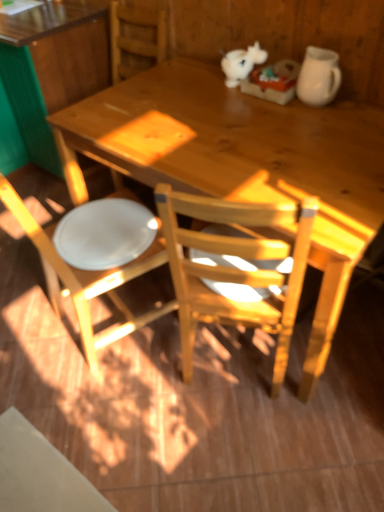
Question: Would you say white matte chair at left is to the left or to the right of wooden desk at upper left, which is the second desk in right-to-left order, in the picture?

Choices:
 (A) right
 (B) left

Answer: (A)

Question: From the image's perspective, relative to wooden desk at upper left, placed as the 1th desk when sorted from left to right, is white matte chair at left above or below?

Choices:
 (A) above
 (B) below

Answer: (B)

Question: Which of these objects is positioned farthest from the white matte unicorn at upper center?

Choices:
 (A) white glossy plate at lower left
 (B) wooden desk at center, which is the second desk from left to right
 (C) wooden desk at upper left, which is the second desk in right-to-left order
 (D) white matte chair at left

Answer: (C)

Question: Estimate the real-world distances between objects in this image. Which object is farther from the white glossy plate at lower left?

Choices:
 (A) wooden desk at upper left, placed as the 1th desk when sorted from left to right
 (B) white matte unicorn at upper center
 (C) wooden desk at center, which is the second desk from left to right
 (D) white matte chair at left

Answer: (A)